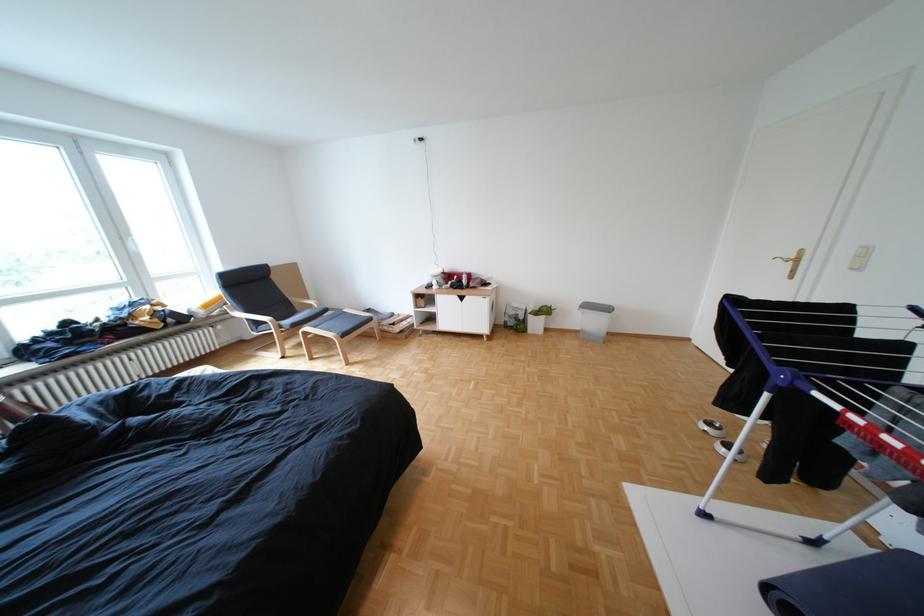
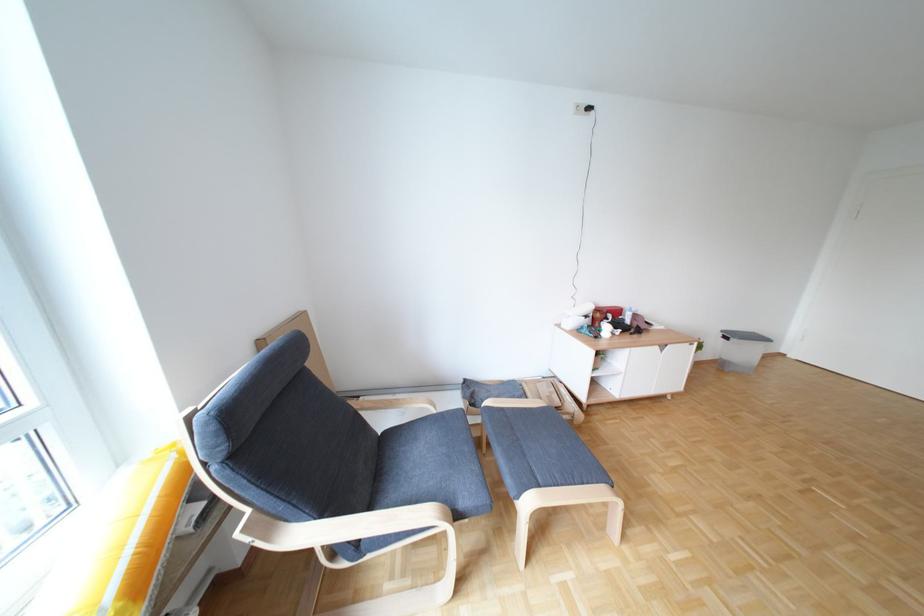
In a continuous first-person perspective shot, in which direction is the camera moving?

The cameraman moved toward left, forward.